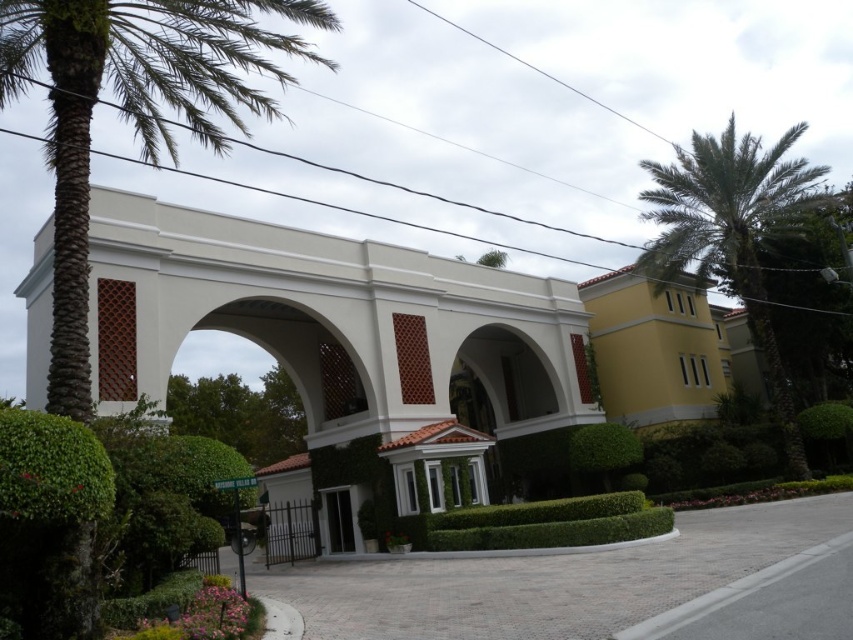
You are a landscape architect designing a pathway that needs to pass between the green leafy palm tree at upper right and the green leafy hedge at center. Considering their heights, which object might require trimming to ensure the pathway remains unobstructed for pedestrians?

The green leafy palm tree at upper right has a greater height compared to the green leafy hedge at center, so the palm tree would require trimming to ensure the pathway remains unobstructed for pedestrians.

You are a drone operator trying to capture a photo of the entrance. The green leafy palm tree at upper right and the yellow matte building at upper right are in the frame. Which object should you adjust your camera angle to avoid blocking the archway?

The green leafy palm tree at upper right might be wider than the yellow matte building at upper right, so adjusting the camera angle to avoid the palm tree would be better to prevent blocking the archway.

From the picture: You are planning to place a new bench in the garden. The bench is 1.5 meters wide. You have two options for placement near the green leafy palm tree at upper right and the green leafy hedge at center. Based on their widths, which location would allow the bench to fit better without overcrowding the area?

The green leafy palm tree at upper right has a larger width than the green leafy hedge at center, so placing the bench near the palm tree would provide more space and prevent overcrowding.